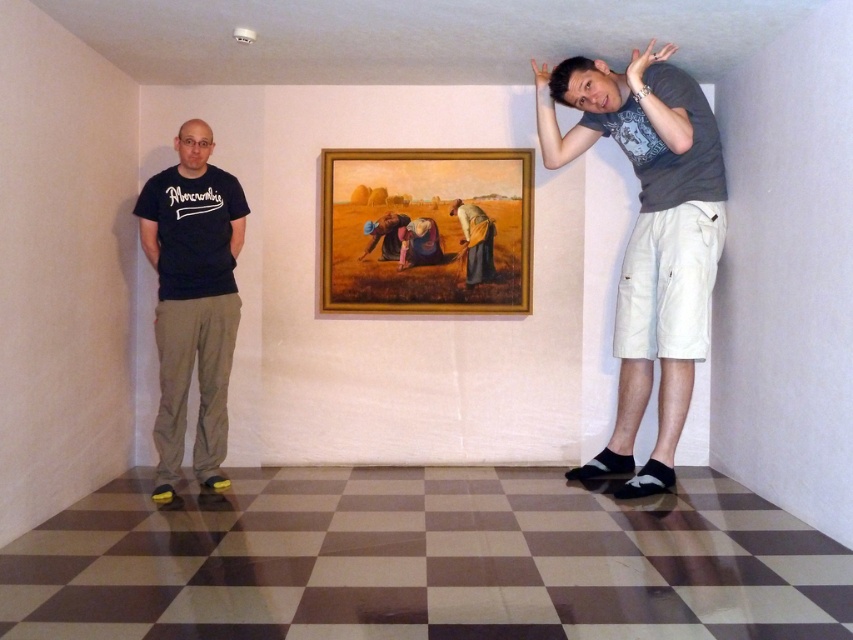
Question: Estimate the real-world distances between objects in this image. Which object is closer to the wooden frame at center?

Choices:
 (A) gray cotton t-shirt at upper right
 (B) brown fabric dress at center

Answer: (B)

Question: Is wooden frame at center to the left of black cotton t-shirt at left from the viewer's perspective?

Choices:
 (A) no
 (B) yes

Answer: (A)

Question: Among these objects, which one is farthest from the camera?

Choices:
 (A) gray cotton t-shirt at upper right
 (B) wooden frame at center
 (C) black cotton t-shirt at left
 (D) brown fabric dress at center

Answer: (D)

Question: Can you confirm if wooden frame at center is wider than brown fabric dress at center?

Choices:
 (A) yes
 (B) no

Answer: (A)

Question: Is wooden frame at center wider than black cotton t-shirt at left?

Choices:
 (A) yes
 (B) no

Answer: (A)

Question: Which object is farther from the camera taking this photo?

Choices:
 (A) black cotton t-shirt at left
 (B) wooden frame at center
 (C) gray cotton t-shirt at upper right

Answer: (B)